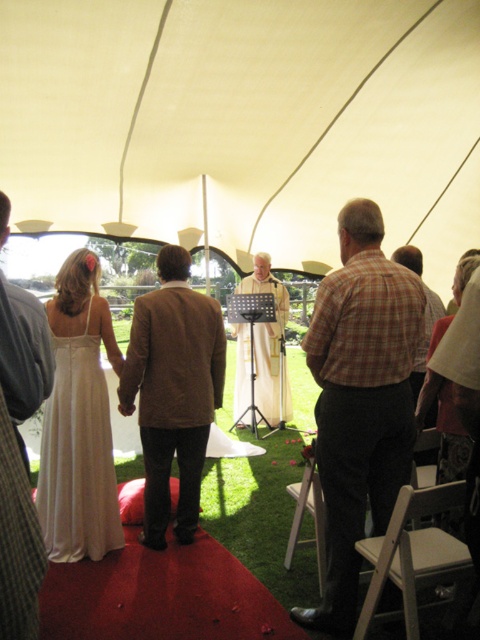
You are a photographer standing at the back of the wedding aisle. You want to capture a closeup shot of both the plaid shirt at center and the plaid fabric shirt at center in the same frame. Given that your camera has a maximum focus range of 24 inches, can you achieve this without moving closer?

The distance between the plaid shirt at center and plaid fabric shirt at center is 24.26 inches. Since the camera can only focus within 24 inches, the photographer would need to move slightly closer to ensure both are within the focus range.

You are standing at the entrance of the wedding tent and want to walk towards the altar where the bride and groom are standing. There are two points marked on the red carpet leading to them. Which point, point (143, 426) or point (40, 508), is closer to you as you stand at the entrance?

Point (143, 426) is closer to you than point (40, 508) because it is closer to the camera position where you are standing at the entrance.